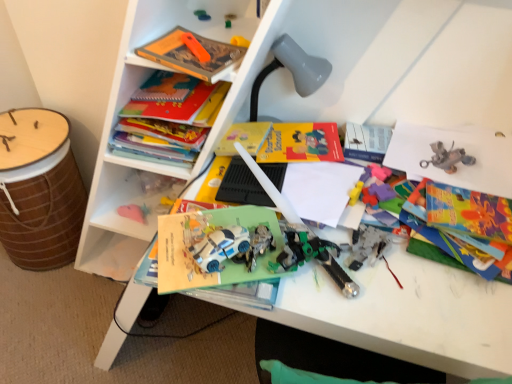
Question: From their relative heights in the image, would you say matte plastic toy at upper center, which ranks as the 1th toy in left-to-right order, is taller or shorter than gray matte lamp at upper center?

Choices:
 (A) tall
 (B) short

Answer: (B)

Question: From a real-world perspective, is matte plastic toy at upper center, which ranks as the 1th toy in left-to-right order, physically located above or below gray matte lamp at upper center?

Choices:
 (A) below
 (B) above

Answer: (B)

Question: Which object is positioned farthest from the white plastic toy car at center?

Choices:
 (A) brown woven drum at left
 (B) gray matte lamp at upper center
 (C) matte plastic toy at upper center, acting as the 4th toy starting from the right
 (D) green plastic toy at center, the third toy in the left-to-right sequence
 (E) matte orange book at upper center, positioned as the second book in back-to-front order

Answer: (A)

Question: Which object is positioned closest to the brown woven drum at left?

Choices:
 (A) matte plastic toy at upper center, the 1th toy from the top
 (B) hardcover book at upper left, which is the 1th book from back to front
 (C) orange plastic toy at upper center, which is the second toy from bottom to top
 (D) gray matte lamp at upper center
 (E) green plastic toy at center, which appears as the second toy when viewed from the right

Answer: (B)